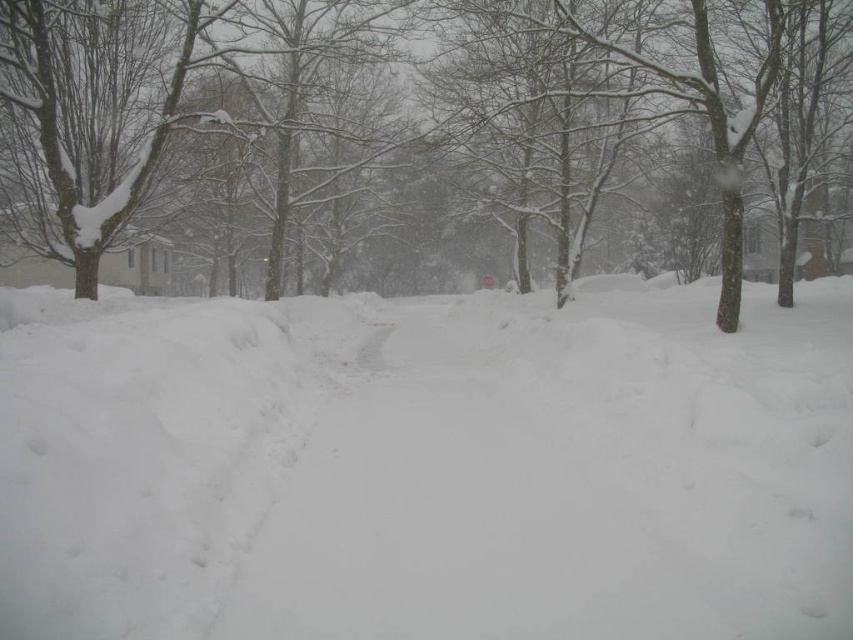
Question: Does white fluffy snow at center appear under snow-covered bark tree at left?

Choices:
 (A) yes
 (B) no

Answer: (A)

Question: Among these points, which one is farthest from the camera?

Choices:
 (A) (26, 80)
 (B) (122, 141)

Answer: (B)

Question: Does snow-covered tree at center lie in front of snow-covered bark tree at left?

Choices:
 (A) yes
 (B) no

Answer: (A)

Question: Which point is closer to the camera?

Choices:
 (A) snow-covered bark tree at left
 (B) snow-covered tree at center

Answer: (B)

Question: Which point is closer to the camera?

Choices:
 (A) (1, 163)
 (B) (402, 536)

Answer: (B)

Question: Does white fluffy snow at center appear under snow-covered bark tree at left?

Choices:
 (A) yes
 (B) no

Answer: (A)